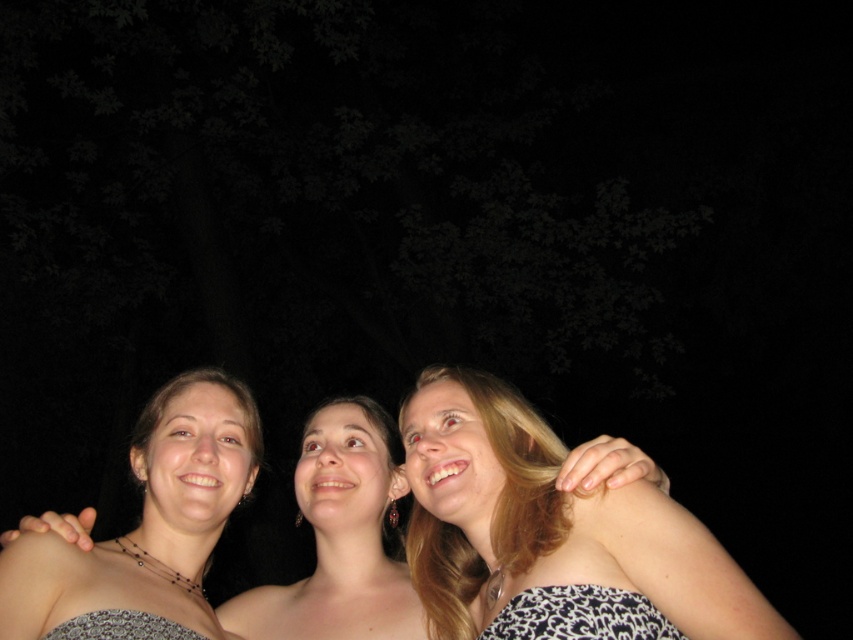
You are a photographer trying to focus on the black printed dress at lower center in a dark outdoor setting. The blonde hair at upper right is in the way. Can you adjust your camera angle to capture the dress without the hair blocking it, considering their positions?

The blonde hair at upper right is closer to the viewer than the black printed dress at lower center. To avoid the hair blocking the dress, you can lower your camera angle slightly to position the dress in front of the hair.

You are trying to identify the position of the blonde hair in the image. Given that the image coordinates are measured from the bottom left corner as the origin, what are the coordinates of the blonde hair at upper right?

The blonde hair at upper right is located at point (550, 529).